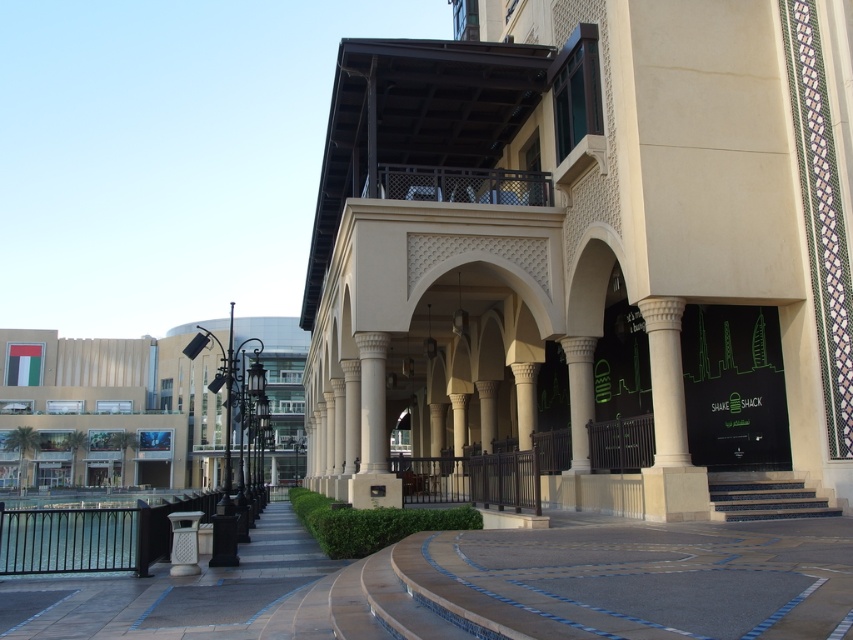
You are a tourist visiting this architectural site and want to take a photo of the smooth stone pavement at center and the white stone column at center. Since you want both objects in the frame, which one should you focus on to ensure both are visible?

You should focus on the white stone column at center because it is smaller in size compared to the smooth stone pavement at center, so keeping it centered will help include both in the frame.

You are a visitor standing in the walkway and want to place a small potted plant between the smooth stone pavement at center and the white stone column at center. Which object should you place the plant closer to in order to ensure it is visible from above?

The smooth stone pavement at center is not as tall as the white stone column at center, so placing the plant closer to the smooth stone pavement at center would ensure it remains visible from above.

You are standing at the entrance of the covered walkway and want to find the beige stone building at center. Based on its coordinates, which direction should you look to locate it?

The beige stone building at center is located at coordinates point (596, 244), which means it is positioned to the lower right from your current position at the entrance of the covered walkway. You should look towards the lower right direction to locate it.